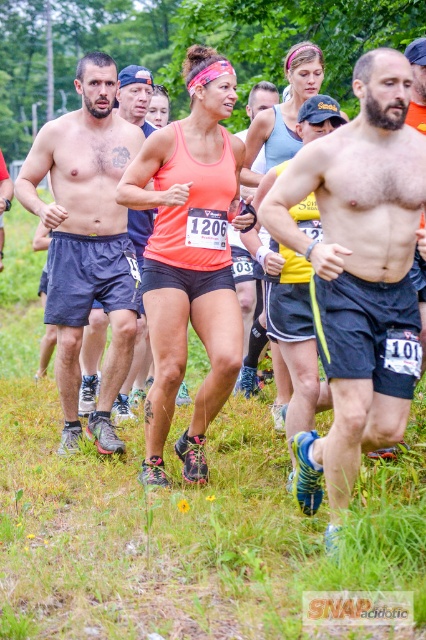
Question: Does shiny blue shorts at center have a smaller size compared to neon orange tank top at center?

Choices:
 (A) no
 (B) yes

Answer: (A)

Question: Which is farther from the neon orange tank top at center?

Choices:
 (A) shiny blue shorts at center
 (B) matte blue shorts at left

Answer: (A)

Question: Where is neon orange tank top at center located in relation to matte blue shorts at left in the image?

Choices:
 (A) above
 (B) below

Answer: (B)

Question: Which is nearer to the matte blue shorts at left?

Choices:
 (A) neon orange tank top at center
 (B) shiny blue shorts at center

Answer: (A)

Question: Does shiny blue shorts at center have a greater width compared to matte blue shorts at left?

Choices:
 (A) yes
 (B) no

Answer: (A)

Question: Which point is closer to the camera?

Choices:
 (A) (340, 349)
 (B) (158, 241)

Answer: (A)